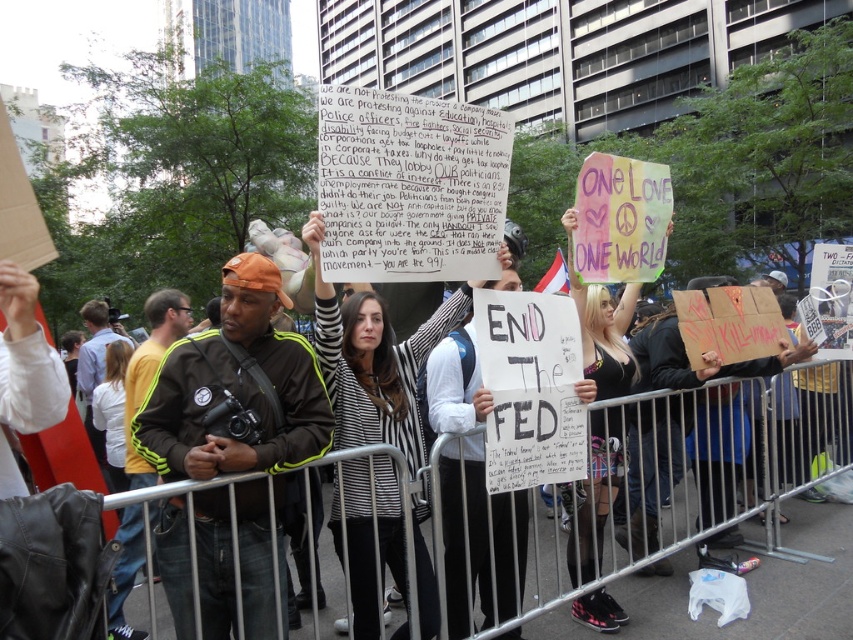
Is matte black jacket at center taller than striped sweater at center?

Correct, matte black jacket at center is much taller as striped sweater at center.

The height and width of the screenshot is (640, 853). Find the location of `matte black jacket at center`. matte black jacket at center is located at coordinates (277, 470).

Is matte black jacket at center to the right of green adidas jacket at center from the viewer's perspective?

Indeed, matte black jacket at center is positioned on the right side of green adidas jacket at center.

Can you confirm if matte black jacket at center is positioned below green adidas jacket at center?

Yes.

Locate an element on the screen. This screenshot has width=853, height=640. matte black jacket at center is located at coordinates (277, 470).

Between green adidas jacket at center and striped sweater at center, which one is positioned higher?

green adidas jacket at center is above.

Between point (238, 502) and point (355, 634), which one is positioned behind?

The point (355, 634) is behind.

Find the location of a particular element. green adidas jacket at center is located at coordinates (238, 396).